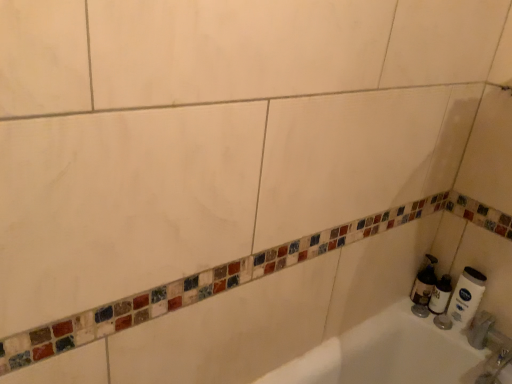
I want to click on white matte toilet paper at right, which is the second toilet paper from right to left, so click(440, 295).

From a real-world perspective, who is located lower, white matte tube at right, which appears as the 1th toilet paper when viewed from the right, or white matte toilet paper at right, which ranks as the first toilet paper in left-to-right order?

white matte toilet paper at right, which ranks as the first toilet paper in left-to-right order, from a real-world perspective.

Is white matte tube at right, which is the second toilet paper in left-to-right order, wider or thinner than white matte toilet paper at right, which ranks as the first toilet paper in left-to-right order?

In the image, white matte tube at right, which is the second toilet paper in left-to-right order, appears to be more narrow than white matte toilet paper at right, which ranks as the first toilet paper in left-to-right order.

Is the surface of white matte tube at right, which appears as the 1th toilet paper when viewed from the right, in direct contact with white matte toilet paper at right, which ranks as the first toilet paper in left-to-right order?

Yes, white matte tube at right, which appears as the 1th toilet paper when viewed from the right, is right next to white matte toilet paper at right, which ranks as the first toilet paper in left-to-right order, and making contact.

Locate an element on the screen. The width and height of the screenshot is (512, 384). toilet paper behind the white matte tube at right, which is the second toilet paper in left-to-right order is located at coordinates (440, 295).

Find the location of `soap dispenser located on the left of white matte toilet paper at right, which is the second toilet paper from right to left`. soap dispenser located on the left of white matte toilet paper at right, which is the second toilet paper from right to left is located at coordinates (424, 287).

Is translucent plastic soap dispenser at lower right far away from white matte toilet paper at right, which ranks as the first toilet paper in left-to-right order?

That's not correct — translucent plastic soap dispenser at lower right is a little close to white matte toilet paper at right, which ranks as the first toilet paper in left-to-right order.

Relative to translucent plastic soap dispenser at lower right, is white matte toilet paper at right, which is the second toilet paper from right to left, in front or behind?

Clearly, white matte toilet paper at right, which is the second toilet paper from right to left, is in front of translucent plastic soap dispenser at lower right.

Is the surface of white matte toilet paper at right, which ranks as the first toilet paper in left-to-right order, in direct contact with translucent plastic soap dispenser at lower right?

Absolutely, white matte toilet paper at right, which ranks as the first toilet paper in left-to-right order, is next to and touching translucent plastic soap dispenser at lower right.

How many degrees apart are the facing directions of white matte toilet paper at right, which is the second toilet paper from right to left, and translucent plastic soap dispenser at lower right?

The angle between the facing direction of white matte toilet paper at right, which is the second toilet paper from right to left, and the facing direction of translucent plastic soap dispenser at lower right is 0.0036 degrees.

Is white matte toilet paper at right, which ranks as the first toilet paper in left-to-right order, taller than translucent plastic soap dispenser at lower right?

No, white matte toilet paper at right, which ranks as the first toilet paper in left-to-right order, is not taller than translucent plastic soap dispenser at lower right.

Where is `the 2nd toilet paper to the right of the translucent plastic soap dispenser at lower right, starting your count from the anchor`? The height and width of the screenshot is (384, 512). the 2nd toilet paper to the right of the translucent plastic soap dispenser at lower right, starting your count from the anchor is located at coordinates (466, 297).

Can you confirm if translucent plastic soap dispenser at lower right is taller than white matte tube at right, which is the second toilet paper in left-to-right order?

No, translucent plastic soap dispenser at lower right is not taller than white matte tube at right, which is the second toilet paper in left-to-right order.

Which object is positioned more to the right, translucent plastic soap dispenser at lower right or white matte tube at right, which appears as the 1th toilet paper when viewed from the right?

white matte tube at right, which appears as the 1th toilet paper when viewed from the right.

Based on the photo, can you tell me how much translucent plastic soap dispenser at lower right and white matte tube at right, which appears as the 1th toilet paper when viewed from the right, differ in facing direction?

There is a 0.00102-degree angle between the facing directions of translucent plastic soap dispenser at lower right and white matte tube at right, which appears as the 1th toilet paper when viewed from the right.

In terms of size, does white matte toilet paper at right, which is the second toilet paper from right to left, appear bigger or smaller than white matte tube at right, which is the second toilet paper in left-to-right order?

white matte toilet paper at right, which is the second toilet paper from right to left, is smaller than white matte tube at right, which is the second toilet paper in left-to-right order.

Is white matte toilet paper at right, which is the second toilet paper from right to left, oriented towards white matte tube at right, which appears as the 1th toilet paper when viewed from the right?

No, white matte toilet paper at right, which is the second toilet paper from right to left, is not oriented towards white matte tube at right, which appears as the 1th toilet paper when viewed from the right.

This screenshot has width=512, height=384. Identify the location of toilet paper on the right of white matte toilet paper at right, which is the second toilet paper from right to left. (466, 297).

Is there a large distance between white matte toilet paper at right, which ranks as the first toilet paper in left-to-right order, and white matte tube at right, which appears as the 1th toilet paper when viewed from the right?

No.

Is white matte tube at right, which appears as the 1th toilet paper when viewed from the right, placed right next to translucent plastic soap dispenser at lower right?

No, white matte tube at right, which appears as the 1th toilet paper when viewed from the right, is not beside translucent plastic soap dispenser at lower right.

Is the depth of white matte tube at right, which appears as the 1th toilet paper when viewed from the right, greater than that of translucent plastic soap dispenser at lower right?

No, it is not.

Which is more to the left, white matte tube at right, which is the second toilet paper in left-to-right order, or translucent plastic soap dispenser at lower right?

Positioned to the left is translucent plastic soap dispenser at lower right.

Choose the correct answer: Is white matte tube at right, which appears as the 1th toilet paper when viewed from the right, inside translucent plastic soap dispenser at lower right or outside it?

white matte tube at right, which appears as the 1th toilet paper when viewed from the right, is not enclosed by translucent plastic soap dispenser at lower right.

Find the location of `toilet paper below the white matte tube at right, which appears as the 1th toilet paper when viewed from the right (from a real-world perspective)`. toilet paper below the white matte tube at right, which appears as the 1th toilet paper when viewed from the right (from a real-world perspective) is located at coordinates click(x=440, y=295).

This screenshot has width=512, height=384. I want to click on soap dispenser behind the white matte toilet paper at right, which ranks as the first toilet paper in left-to-right order, so click(x=424, y=287).

Considering their positions, is white matte toilet paper at right, which ranks as the first toilet paper in left-to-right order, positioned further to white matte tube at right, which is the second toilet paper in left-to-right order, than translucent plastic soap dispenser at lower right?

Among the two, translucent plastic soap dispenser at lower right is located further to white matte tube at right, which is the second toilet paper in left-to-right order.

Estimate the real-world distances between objects in this image. Which object is further from white matte tube at right, which is the second toilet paper in left-to-right order, translucent plastic soap dispenser at lower right or white matte toilet paper at right, which is the second toilet paper from right to left?

The object further to white matte tube at right, which is the second toilet paper in left-to-right order, is translucent plastic soap dispenser at lower right.

Which object lies nearer to the anchor point white matte toilet paper at right, which ranks as the first toilet paper in left-to-right order, translucent plastic soap dispenser at lower right or white matte tube at right, which is the second toilet paper in left-to-right order?

Among the two, translucent plastic soap dispenser at lower right is located nearer to white matte toilet paper at right, which ranks as the first toilet paper in left-to-right order.

Considering their positions, is white matte tube at right, which is the second toilet paper in left-to-right order, positioned further to white matte toilet paper at right, which is the second toilet paper from right to left, than translucent plastic soap dispenser at lower right?

The object further to white matte toilet paper at right, which is the second toilet paper from right to left, is white matte tube at right, which is the second toilet paper in left-to-right order.

Looking at the image, which one is located closer to translucent plastic soap dispenser at lower right, white matte toilet paper at right, which ranks as the first toilet paper in left-to-right order, or white matte tube at right, which is the second toilet paper in left-to-right order?

white matte toilet paper at right, which ranks as the first toilet paper in left-to-right order, is positioned closer to the anchor translucent plastic soap dispenser at lower right.

Based on their spatial positions, is white matte tube at right, which is the second toilet paper in left-to-right order, or white matte toilet paper at right, which ranks as the first toilet paper in left-to-right order, closer to translucent plastic soap dispenser at lower right?

white matte toilet paper at right, which ranks as the first toilet paper in left-to-right order, is closer to translucent plastic soap dispenser at lower right.

The height and width of the screenshot is (384, 512). I want to click on toilet paper between white matte tube at right, which appears as the 1th toilet paper when viewed from the right, and translucent plastic soap dispenser at lower right in the front-back direction, so click(x=440, y=295).